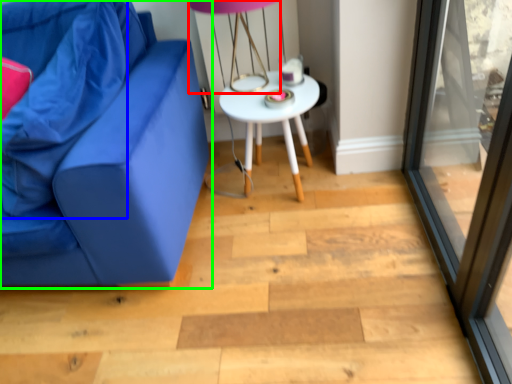
Question: Estimate the real-world distances between objects in this image. Which object is closer to table lamp (highlighted by a red box), pillow (highlighted by a blue box) or studio couch (highlighted by a green box)?

Choices:
 (A) pillow
 (B) studio couch

Answer: (B)